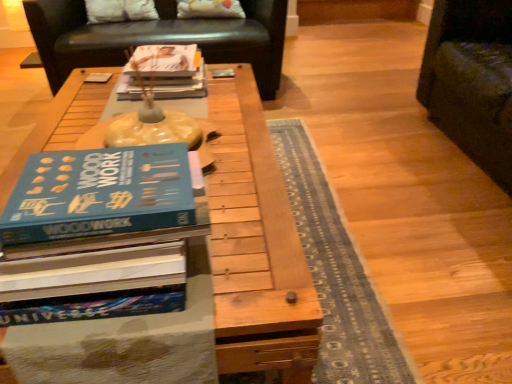
Locate an element on the screen. vacant area to the right of wooden table at center is located at coordinates (382, 233).